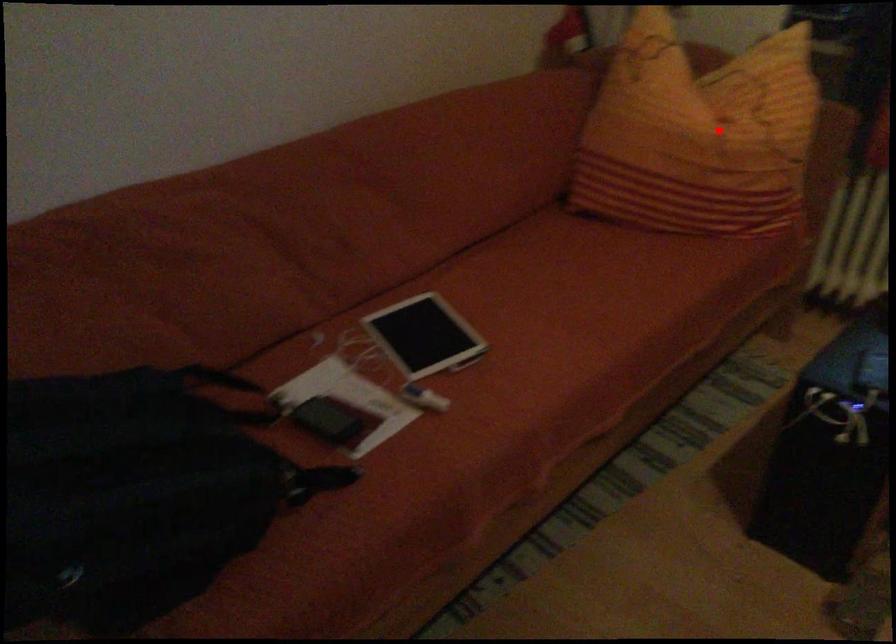
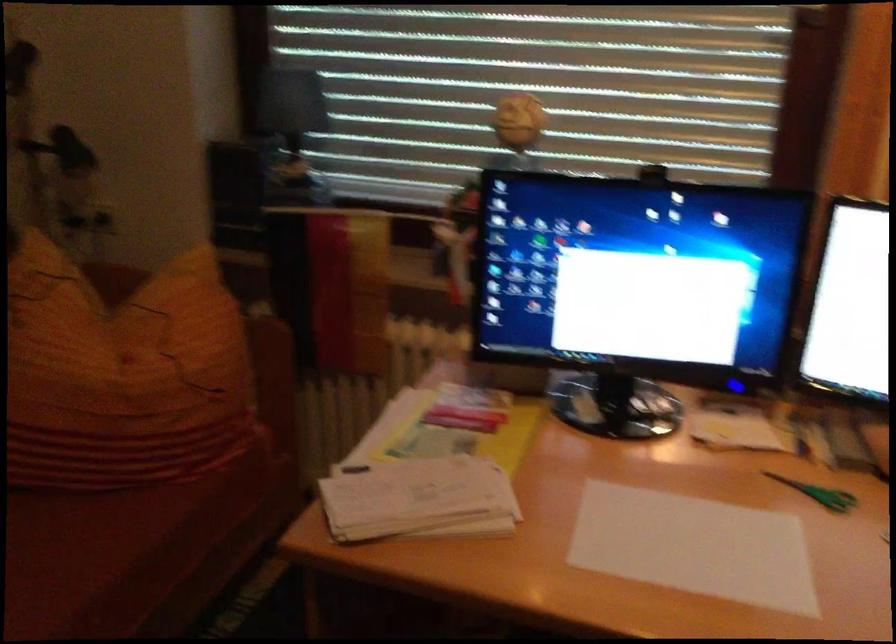
Question: I am providing you with two images of the same scene from different viewpoints. A red point is marked on the first image. Can you still see the location of the red point in image 2?

Choices:
 (A) Yes
 (B) No

Answer: (A)